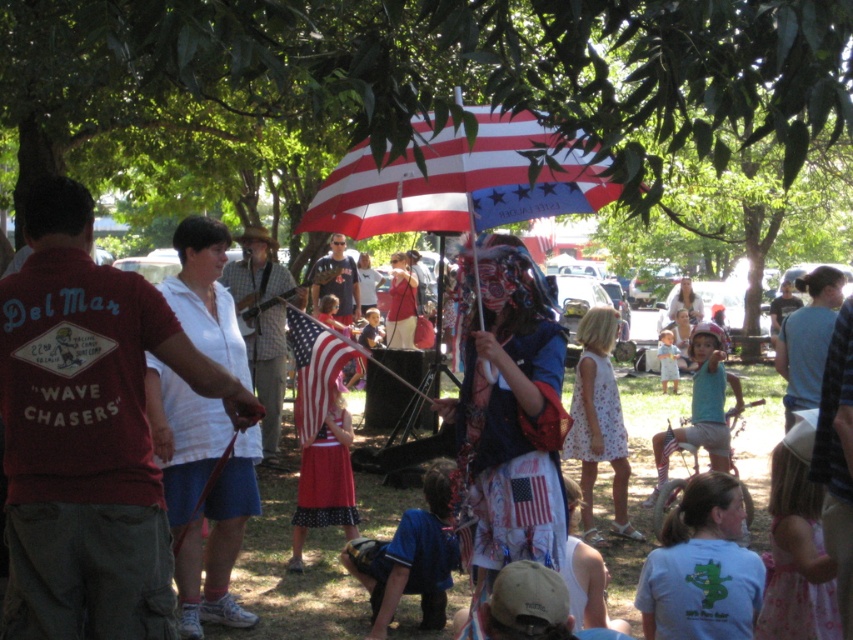
You are taking a photo of the lively outdoor gathering and want to focus on the two points in the scene. Which point, point (173, 332) or point (221, 333), is closer to your camera lens?

Point (173, 332) is closer to the camera lens than point (221, 333).

In the scene shown: You are organizing a photo shoot and need to position two models wearing the white floral dress at center and the red fabric skirt at center. The minimum distance required between them for the shot is 5 feet. Based on the scene description, will they be able to maintain this distance?

The white floral dress at center and red fabric skirt at center are 5.03 feet apart, which is slightly more than the required 5 feet, so they can maintain the distance.